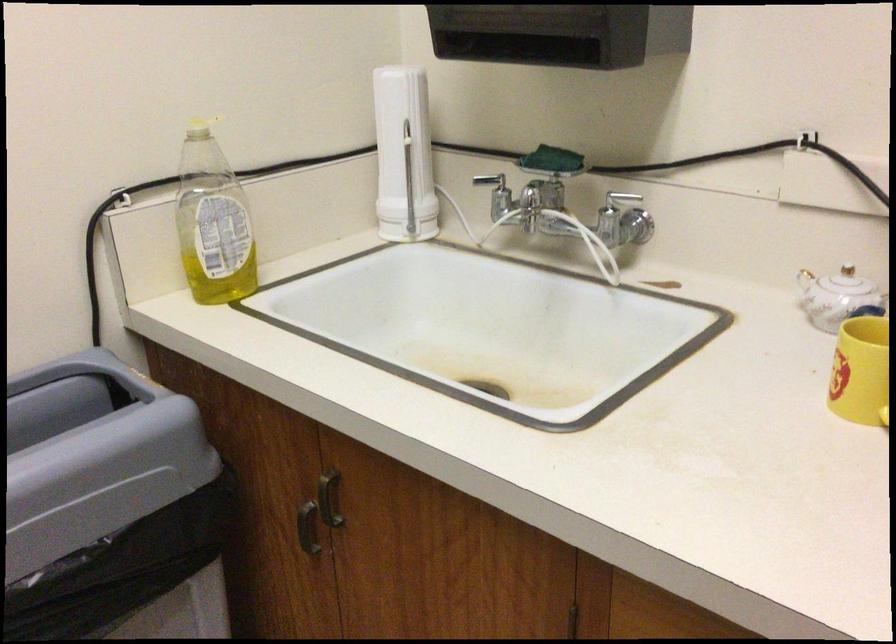
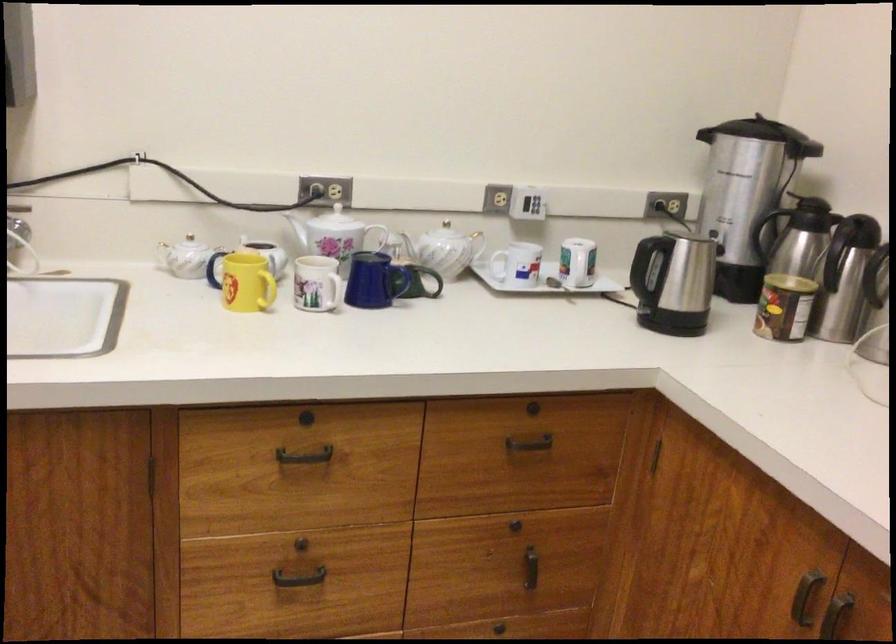
Question: The images are taken continuously from a first-person perspective. In which direction is your viewpoint rotating?

Choices:
 (A) Left
 (B) Right
 (C) Up
 (D) Down

Answer: (B)